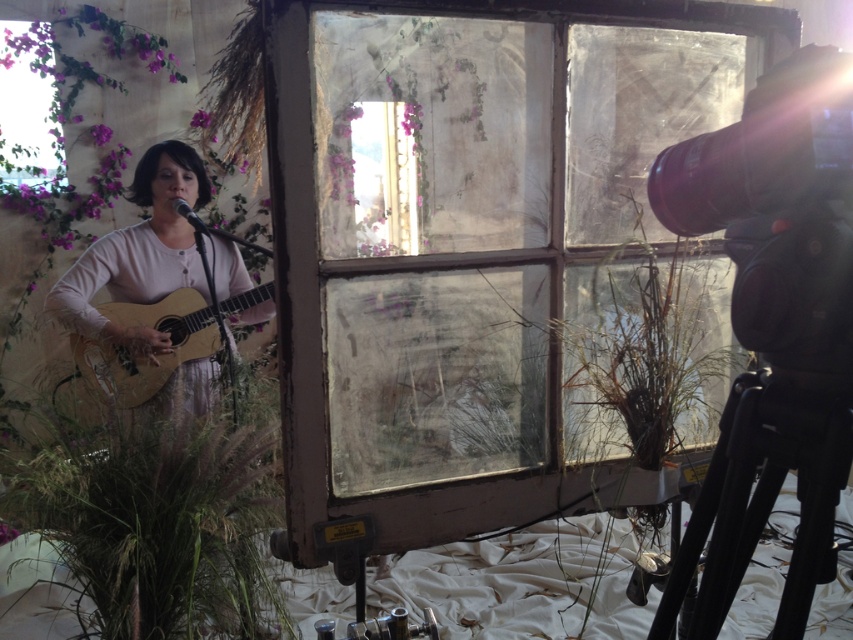
Question: Which object appears farthest from the camera in this image?

Choices:
 (A) matte pink dress at left
 (B) acoustic wood guitar at left
 (C) transparent glass window at center

Answer: (B)

Question: Which point appears closest to the camera in this image?

Choices:
 (A) (695, 88)
 (B) (184, 237)
 (C) (735, 397)

Answer: (C)

Question: Can you confirm if black matte tripod at lower right is positioned above matte pink dress at left?

Choices:
 (A) yes
 (B) no

Answer: (B)

Question: Is green grass at lower left positioned behind acoustic wood guitar at left?

Choices:
 (A) no
 (B) yes

Answer: (A)

Question: Which of the following is the closest to the observer?

Choices:
 (A) (726, 524)
 (B) (136, 403)
 (C) (310, 288)

Answer: (A)

Question: Is the position of matte pink dress at left more distant than that of acoustic wood guitar at left?

Choices:
 (A) yes
 (B) no

Answer: (B)